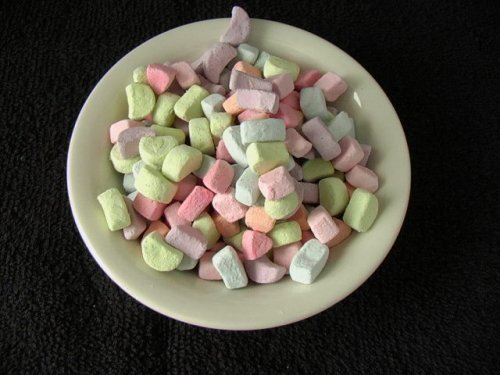
The image size is (500, 375). In order to click on white bowl in this screenshot , I will do `click(390, 128)`.